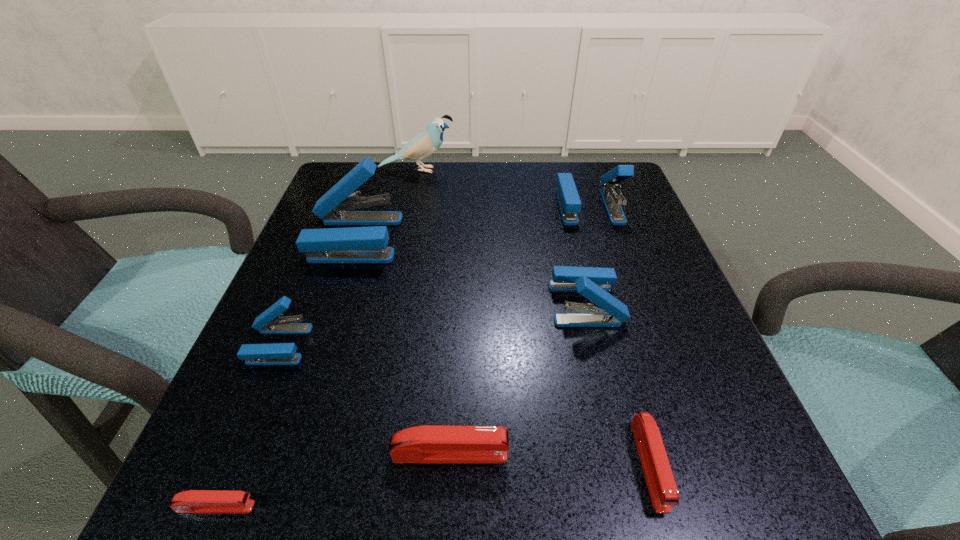
Locate an element on the screen. the second red stapler from right to left is located at coordinates (428, 443).

The image size is (960, 540). I want to click on the rightmost red stapler, so click(662, 488).

Where is `the sixth tallest stapler`? the sixth tallest stapler is located at coordinates (662, 488).

Where is `the smallest red stapler`? The image size is (960, 540). the smallest red stapler is located at coordinates (193, 501).

At what (x,y) coordinates should I click in order to perform the action: click on the shortest stapler. Please return your answer as a coordinate pair (x, y). This screenshot has width=960, height=540. Looking at the image, I should click on (193, 501).

You are a GUI agent. You are given a task and a screenshot of the screen. Output one action in this format:
    pyautogui.click(x=<x>, y=<y>)
    Task: Click on the vacant area situated 0.120m at the face of the blue bird
    The image size is (960, 540).
    Given the screenshot: What is the action you would take?
    pyautogui.click(x=502, y=170)

Identify the location of vacant position located 0.150m on the right of the tallest stapler. (471, 238).

Image resolution: width=960 pixels, height=540 pixels. Identify the location of free spot located on the left of the third tallest object. (386, 206).

The height and width of the screenshot is (540, 960). Identify the location of blank area located 0.180m on the back of the third tallest stapler. (566, 224).

Locate an element on the screen. vacant area located 0.160m on the back of the smallest blue stapler is located at coordinates (313, 262).